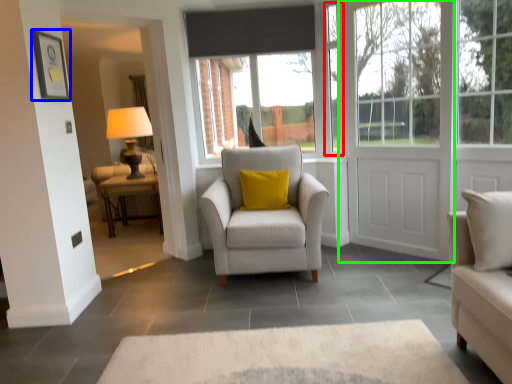
Question: Which object is the closest to the window frame (highlighted by a red box)? Choose among these: picture frame (highlighted by a blue box) or door (highlighted by a green box).

Choices:
 (A) picture frame
 (B) door

Answer: (B)